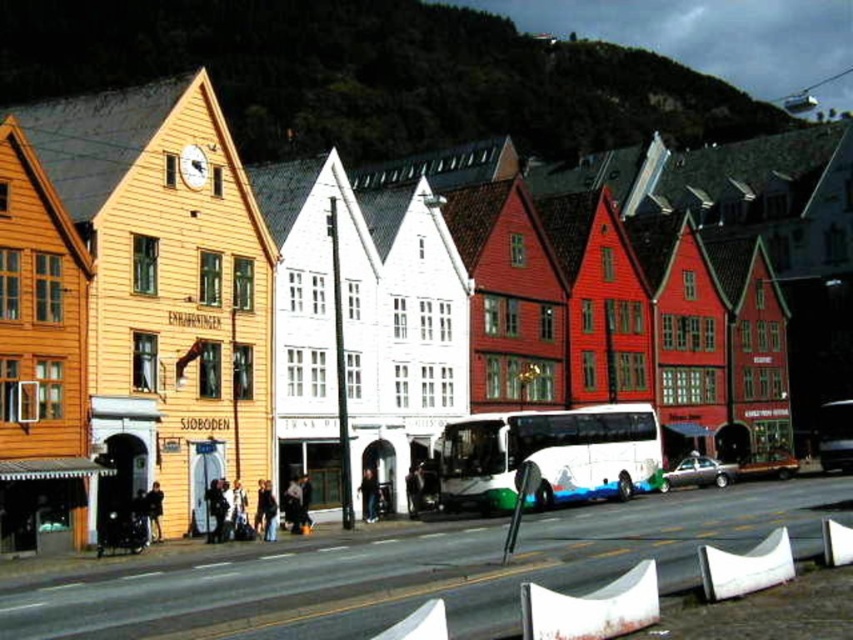
Question: Which object is closer to the camera taking this photo?

Choices:
 (A) metallic silver car at center
 (B) white glossy bus at center

Answer: (B)

Question: Is white glossy bus at center positioned in front of silver metallic sedan at center?

Choices:
 (A) no
 (B) yes

Answer: (B)

Question: Which of the following is the closest to the observer?

Choices:
 (A) white glossy bus at center
 (B) metallic silver car at center
 (C) silver metallic sedan at center

Answer: (A)

Question: Does silver metallic sedan at center appear over metallic silver car at center?

Choices:
 (A) no
 (B) yes

Answer: (B)

Question: Which of the following is the farthest from the observer?

Choices:
 (A) (775, 452)
 (B) (711, 472)

Answer: (A)

Question: From the image, what is the correct spatial relationship of silver metallic sedan at center in relation to metallic silver car at center?

Choices:
 (A) below
 (B) above

Answer: (B)